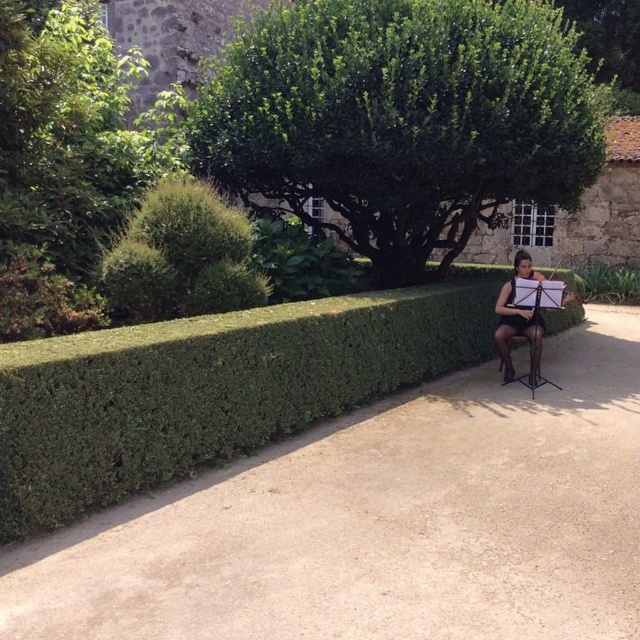
You are walking along the pathway in the garden scene and notice the green leafy tree at center and the black sheer dress at right. Which object is positioned closer to the left side of the path?

The green leafy tree at center is positioned to the left of the black sheer dress at right, so it is closer to the left side of the path.

You are standing at the origin point of the garden map. You need to walk to the dirt path at center. According to the garden map coordinates, what are the coordinates where you should arrive?

The coordinates for the dirt path at center are at point (x=380, y=522).

You are planning to walk along the dirt path at center while wearing the black sheer dress at right. Considering the path width, do you think the dress might get caught on the sides?

The dirt path at center is narrower than the black sheer dress at right, so there is a risk the dress might get caught on the sides as you walk.